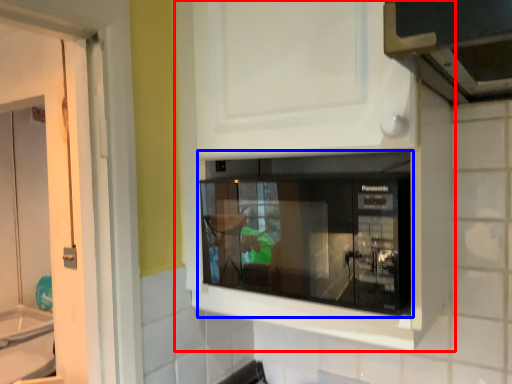
Question: Which object appears farthest to the camera in this image, cabinetry (highlighted by a red box) or microwave oven (highlighted by a blue box)?

Choices:
 (A) cabinetry
 (B) microwave oven

Answer: (B)